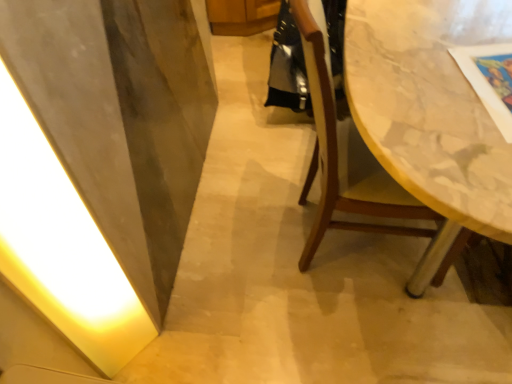
Question: Does white glossy light at left have a larger size compared to shiny black robe at center?

Choices:
 (A) no
 (B) yes

Answer: (A)

Question: Is white glossy light at left outside shiny black robe at center?

Choices:
 (A) no
 (B) yes

Answer: (B)

Question: Is the depth of white glossy light at left less than that of shiny black robe at center?

Choices:
 (A) no
 (B) yes

Answer: (B)

Question: Is white glossy light at left further to camera compared to shiny black robe at center?

Choices:
 (A) yes
 (B) no

Answer: (B)

Question: Is white glossy light at left oriented away from shiny black robe at center?

Choices:
 (A) no
 (B) yes

Answer: (A)

Question: Is point (311, 41) positioned closer to the camera than point (50, 240)?

Choices:
 (A) closer
 (B) farther

Answer: (A)

Question: From the image's perspective, is wooden chair at right above or below white glossy light at left?

Choices:
 (A) below
 (B) above

Answer: (B)

Question: Considering the positions of wooden chair at right and white glossy light at left in the image, is wooden chair at right wider or thinner than white glossy light at left?

Choices:
 (A) wide
 (B) thin

Answer: (A)

Question: Based on their sizes in the image, would you say wooden chair at right is bigger or smaller than white glossy light at left?

Choices:
 (A) small
 (B) big

Answer: (B)

Question: Would you say wooden chair at right is to the left or to the right of shiny black robe at center in the picture?

Choices:
 (A) right
 (B) left

Answer: (A)

Question: Looking at the image, does wooden chair at right seem bigger or smaller compared to shiny black robe at center?

Choices:
 (A) small
 (B) big

Answer: (B)

Question: Does point coord(388,211) appear closer or farther from the camera than point coord(309,109)?

Choices:
 (A) closer
 (B) farther

Answer: (A)

Question: Considering the positions of wooden chair at right and shiny black robe at center in the image, is wooden chair at right taller or shorter than shiny black robe at center?

Choices:
 (A) tall
 (B) short

Answer: (A)

Question: Is white glossy light at left in front of or behind shiny black robe at center in the image?

Choices:
 (A) front
 (B) behind

Answer: (A)

Question: From the image's perspective, is white glossy light at left above or below shiny black robe at center?

Choices:
 (A) above
 (B) below

Answer: (B)